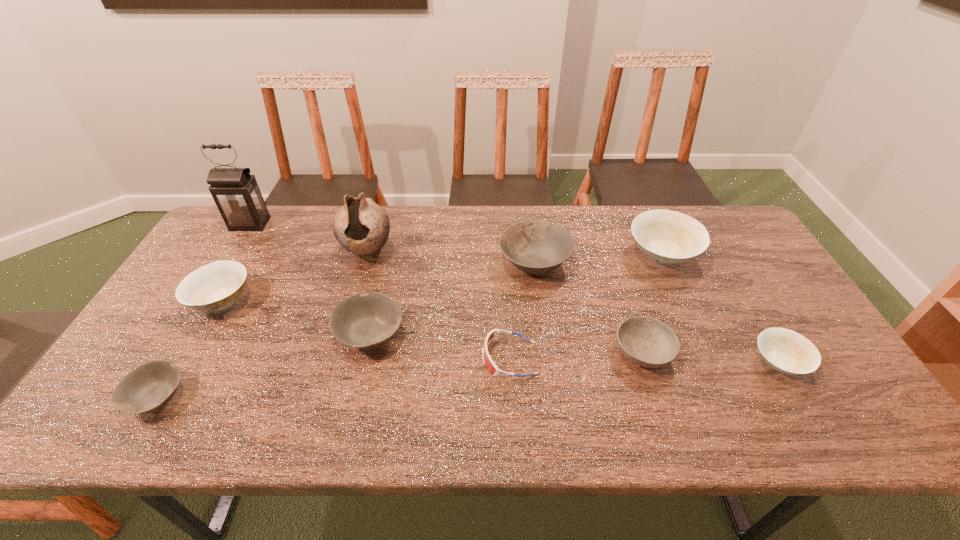
What are the coordinates of `red goggles` in the screenshot? It's located at (488, 362).

In order to click on the smallest gray bowl in this screenshot , I will do [146, 388].

The height and width of the screenshot is (540, 960). Identify the location of the nearest gray bowl. (146, 388).

Locate an element on the screen. Image resolution: width=960 pixels, height=540 pixels. free spot located on the front-facing side of the lantern is located at coordinates (229, 257).

This screenshot has height=540, width=960. What are the coordinates of `vacant area situated 0.370m from the spout of the pottery` in the screenshot? It's located at (333, 374).

This screenshot has height=540, width=960. What are the coordinates of `vacant space located on the back of the biggest beige bowl` in the screenshot? It's located at coord(643,214).

Where is `vacant area situated 0.290m on the front of the farthest gray bowl`? The height and width of the screenshot is (540, 960). vacant area situated 0.290m on the front of the farthest gray bowl is located at coordinates (549, 374).

This screenshot has height=540, width=960. I want to click on vacant space situated on the back of the leftmost beige bowl, so click(264, 226).

This screenshot has width=960, height=540. Find the location of `vacant space located on the right of the second farthest gray bowl`. vacant space located on the right of the second farthest gray bowl is located at coordinates (539, 334).

Locate an element on the screen. Image resolution: width=960 pixels, height=540 pixels. vacant space positioned 0.360m on the left of the nearest beige bowl is located at coordinates (606, 362).